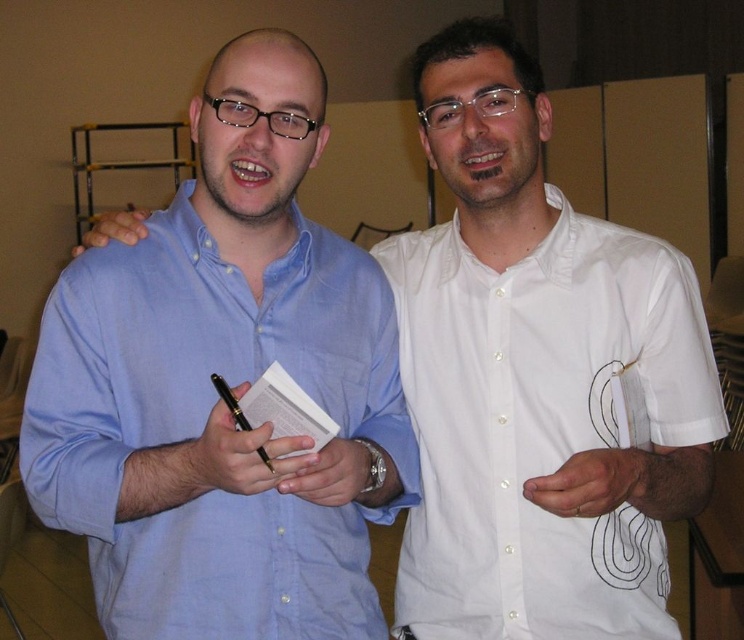
Does matte black pen at center have a greater width compared to black glossy pen at center?

Correct, the width of matte black pen at center exceeds that of black glossy pen at center.

Describe the element at coordinates (240, 456) in the screenshot. I see `matte black pen at center` at that location.

Find the location of `matte black pen at center`. matte black pen at center is located at coordinates (240, 456).

Does matte black pen at center have a larger size compared to white matte hand at center?

Actually, matte black pen at center might be smaller than white matte hand at center.

Between point (189, 451) and point (583, 456), which one is positioned in front?

Point (583, 456)

This screenshot has width=744, height=640. I want to click on matte black pen at center, so click(x=240, y=456).

Is white matte hand at center smaller than matte skin hand at center?

Indeed, white matte hand at center has a smaller size compared to matte skin hand at center.

Can you confirm if white matte hand at center is thinner than matte skin hand at center?

Yes, white matte hand at center is thinner than matte skin hand at center.

Where is `white matte hand at center`? white matte hand at center is located at coordinates (594, 483).